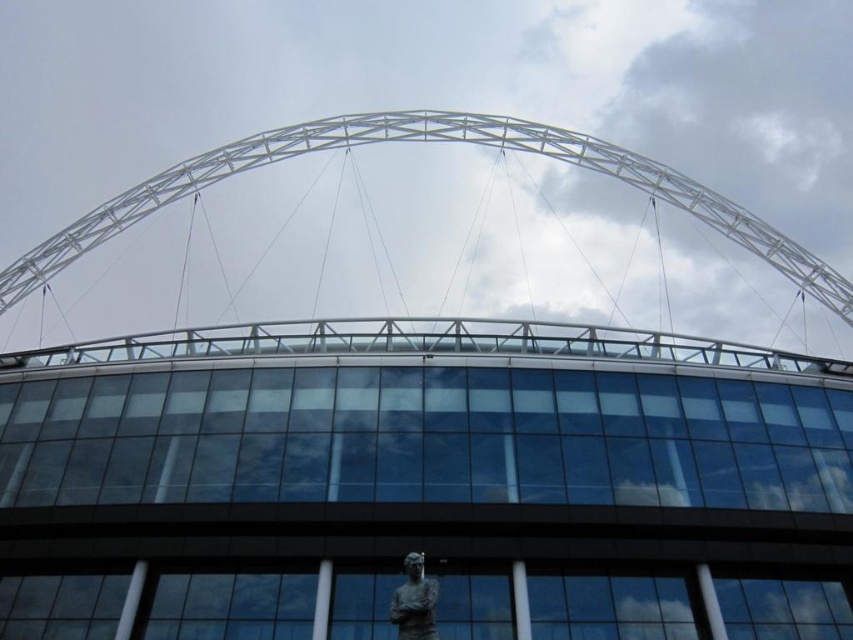
You are standing at point (426, 141) in the image. What object is located exactly at your current position?

The white metallic arch at center is located exactly at point (426, 141).

You are standing in front of the modern building with the arched roof and glass facade. You notice two points marked on the structure. The first point is at coordinates point (x=555, y=125) and the second is at point (x=424, y=586). Which of these points is closer to you?

Point (x=555, y=125) is further to the camera than point (x=424, y=586), so the point closer to you is point (x=424, y=586).